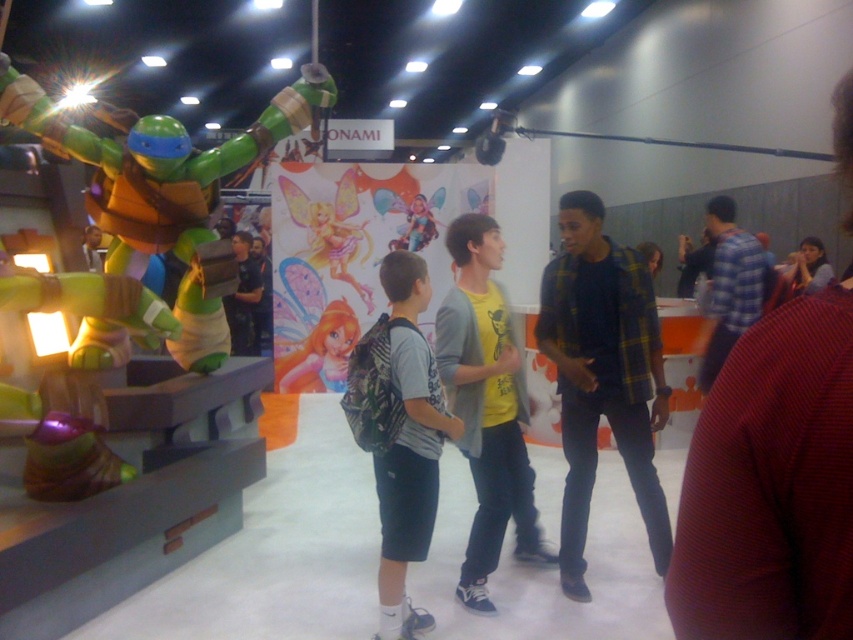
You are at the convention and want to take a photo of the ONAMI display without any obstructions. You notice the gray fabric backpack at center and the smooth skin face at upper right. Which object should you avoid positioning in front of your camera lens to ensure a clear view?

To ensure a clear view of the ONAMI display, you should avoid positioning the gray fabric backpack at center in front of your camera lens, as it is located in front of the smooth skin face at upper right and may obstruct the view.

You are a photographer trying to capture a clear shot of the gray fabric backpack at center and the smooth skin face at upper right. Since the backpack is smaller, how should you adjust your camera to ensure both are in focus?

The gray fabric backpack at center is smaller than the smooth skin face at upper right, so you should adjust your camera to focus on the closer object or use a wider aperture to increase depth of field, ensuring both are sharp.

You are a photographer at the convention and want to capture a photo of the smooth skin face at upper right without the gray fabric backpack at center appearing in the frame. Is this possible based on their positions?

The gray fabric backpack at center is below the smooth skin face at upper right, so it is possible to frame the photo to include the smooth skin face at upper right while excluding the gray fabric backpack at center by adjusting the camera angle upwards.